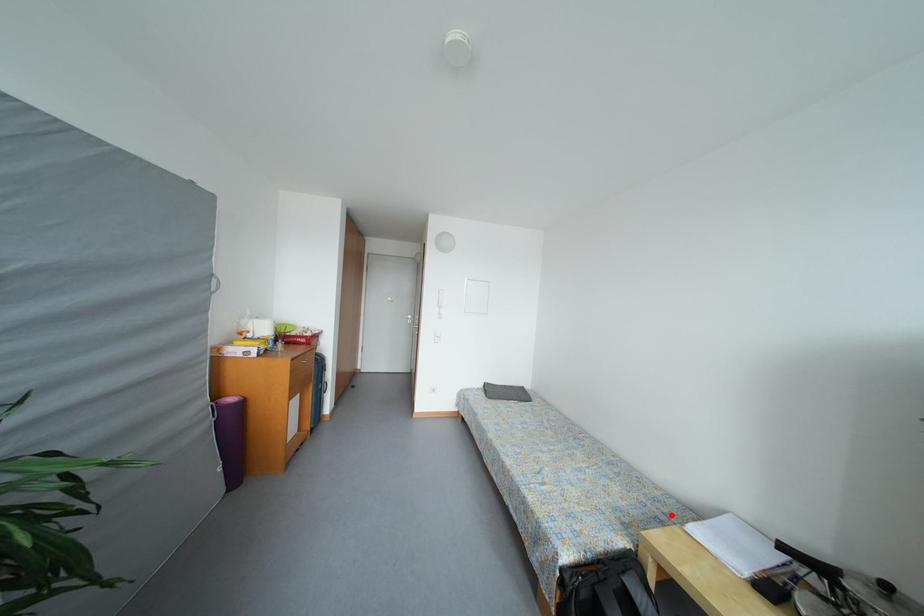
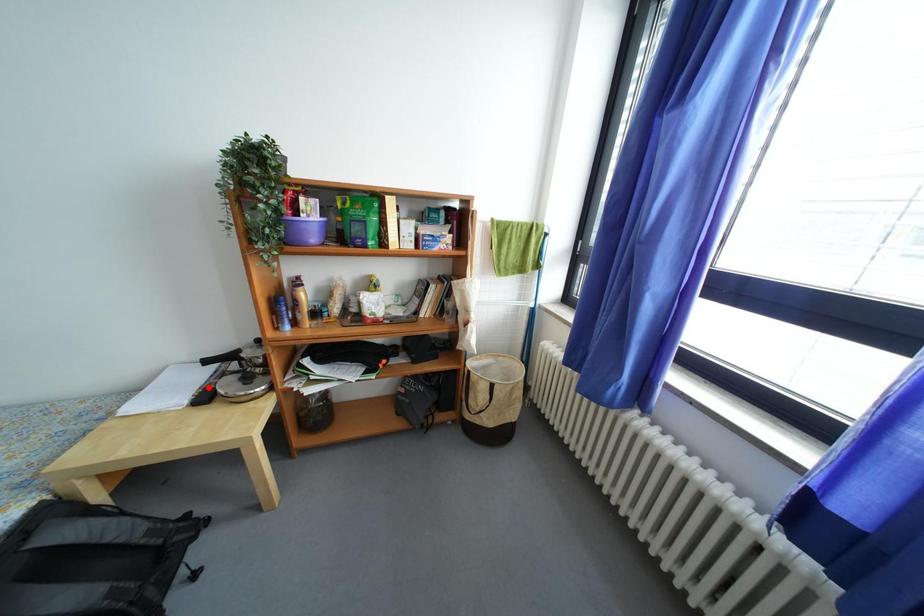
I am providing you with two images of the same scene from different viewpoints. A red point is marked on the first image and another point is marked on the second image. Does the point marked in image1 correspond to the same location as the one in image2?

No